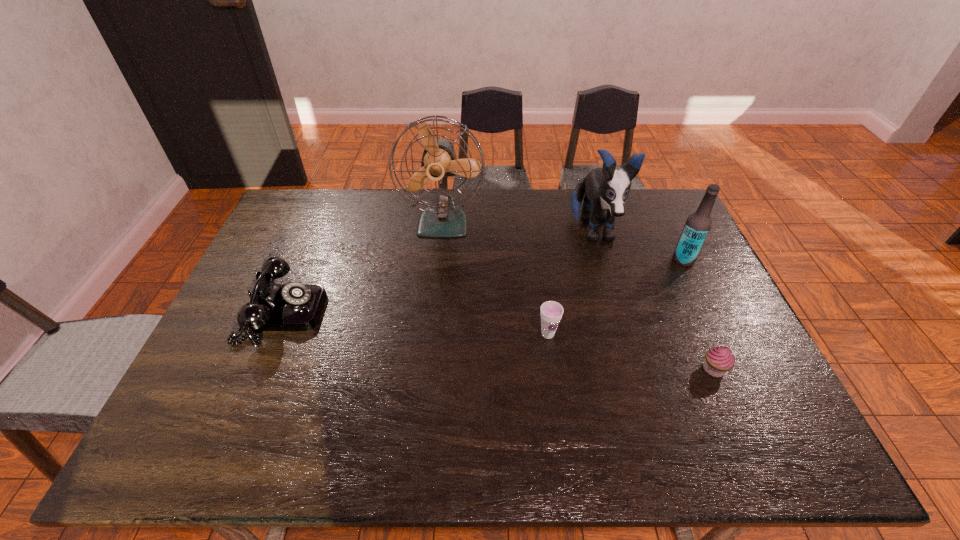
At what (x,y) coordinates should I click in order to perform the action: click on vacant region located on the label of the beer bottle. Please return your answer as a coordinate pair (x, y). Looking at the image, I should click on (615, 260).

Where is `vacant space situated 0.070m on the label of the beer bottle`? This screenshot has height=540, width=960. vacant space situated 0.070m on the label of the beer bottle is located at coordinates (650, 260).

Locate an element on the screen. vacant area situated 0.360m on the dial of the leftmost object is located at coordinates (450, 313).

Where is `free space located 0.200m on the back of the third object from left to right`? This screenshot has height=540, width=960. free space located 0.200m on the back of the third object from left to right is located at coordinates (540, 274).

The image size is (960, 540). In order to click on vacant area situated on the back of the cupcake in this screenshot , I will do `click(682, 295)`.

Image resolution: width=960 pixels, height=540 pixels. Find the location of `fan located in the far edge section of the desktop`. fan located in the far edge section of the desktop is located at coordinates (443, 218).

Identify the location of puppy at the far edge. This screenshot has height=540, width=960. (606, 189).

At what (x,y) coordinates should I click in order to perform the action: click on object that is at the left edge. Please return your answer as a coordinate pair (x, y). Looking at the image, I should click on (294, 306).

You are a GUI agent. You are given a task and a screenshot of the screen. Output one action in this format:
    pyautogui.click(x=<x>, y=<y>)
    Task: Click on the beer bottle that is at the right edge
    This screenshot has width=960, height=540.
    Given the screenshot: What is the action you would take?
    pyautogui.click(x=698, y=224)

Where is `cupcake at the right edge`? This screenshot has height=540, width=960. cupcake at the right edge is located at coordinates (718, 360).